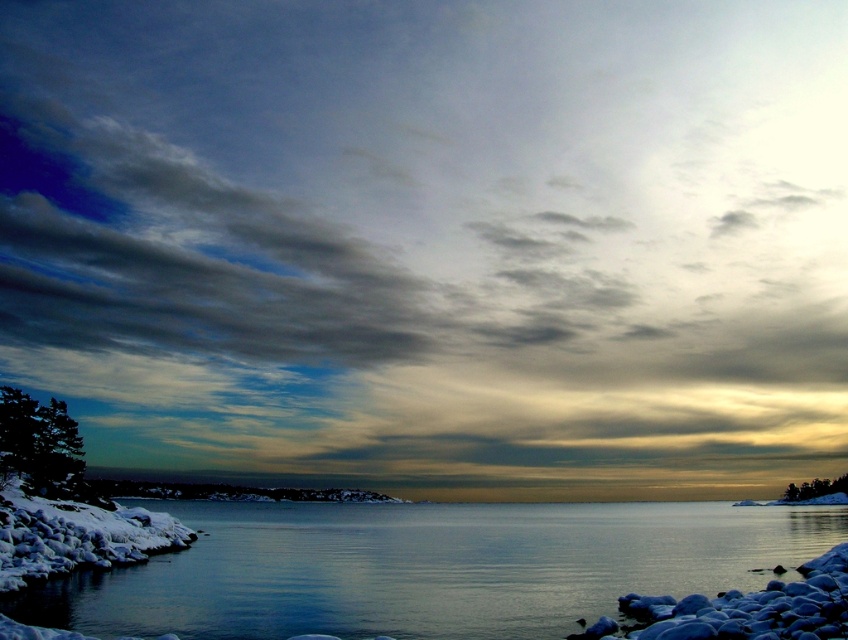
You are standing on the beach and see the clear glass water at center and the green matte tree at lower left. Which object is closer to the horizon?

The clear glass water at center is closer to the horizon because it is located below the green matte tree at lower left, meaning it is positioned lower in the frame and nearer to the horizon line.